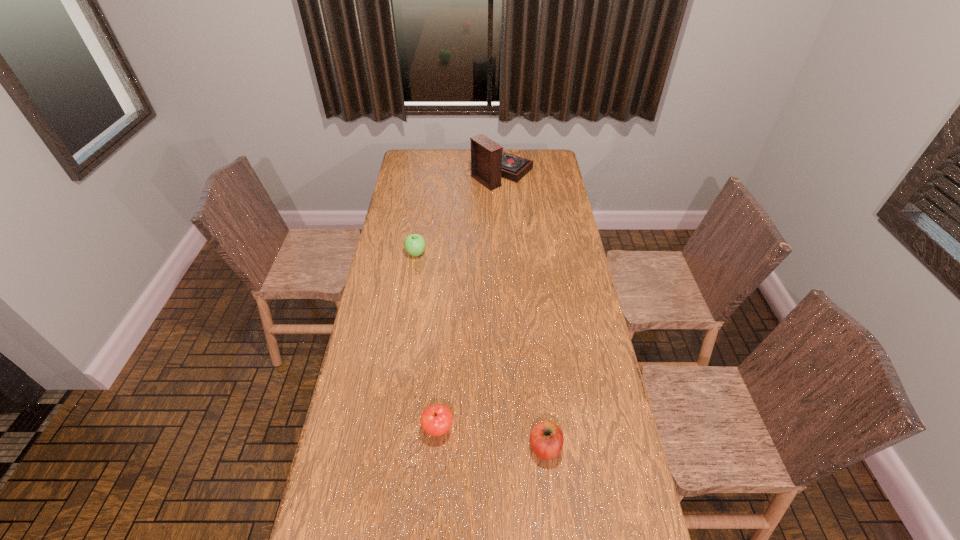
Choose which apple is the nearest neighbor to the second apple from right to left. Please provide its 2D coordinates. Your answer should be formatted as a tuple, i.e. [(x, y)], where the tuple contains the x and y coordinates of a point satisfying the conditions above.

[(546, 438)]

Identify which apple is located as the second nearest to the rightmost apple. Please provide its 2D coordinates. Your answer should be formatted as a tuple, i.e. [(x, y)], where the tuple contains the x and y coordinates of a point satisfying the conditions above.

[(414, 244)]

Identify the location of free point that satisfies the following two spatial constraints: 1. on the front side of the second apple from right to left; 2. on the left side of the farthest apple. (389, 428).